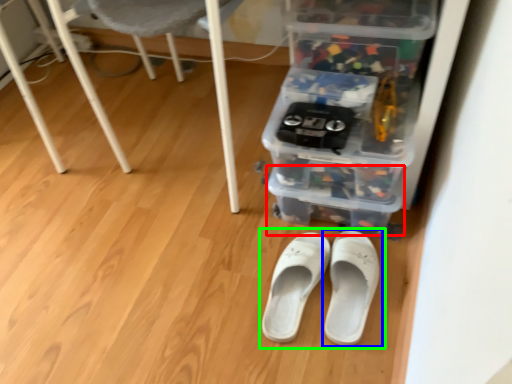
Question: Considering the real-world distances, which object is farthest from storage box (highlighted by a red box)? footwear (highlighted by a blue box) or footwear (highlighted by a green box)?

Choices:
 (A) footwear
 (B) footwear

Answer: (B)